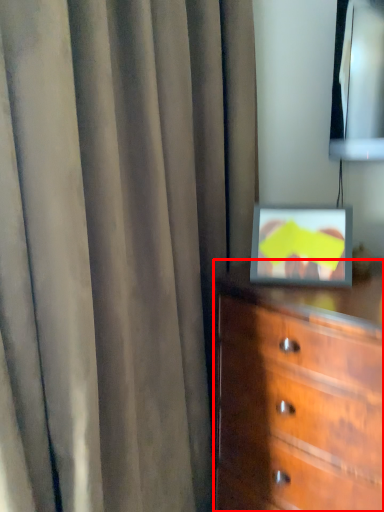
Question: In this image, where is chest of drawers (annotated by the red box) located relative to curtain?

Choices:
 (A) left
 (B) right

Answer: (B)